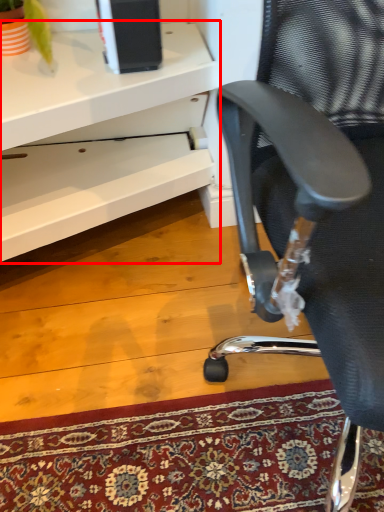
Question: From the image's perspective, where is desk (annotated by the red box) located relative to chair?

Choices:
 (A) above
 (B) below

Answer: (A)